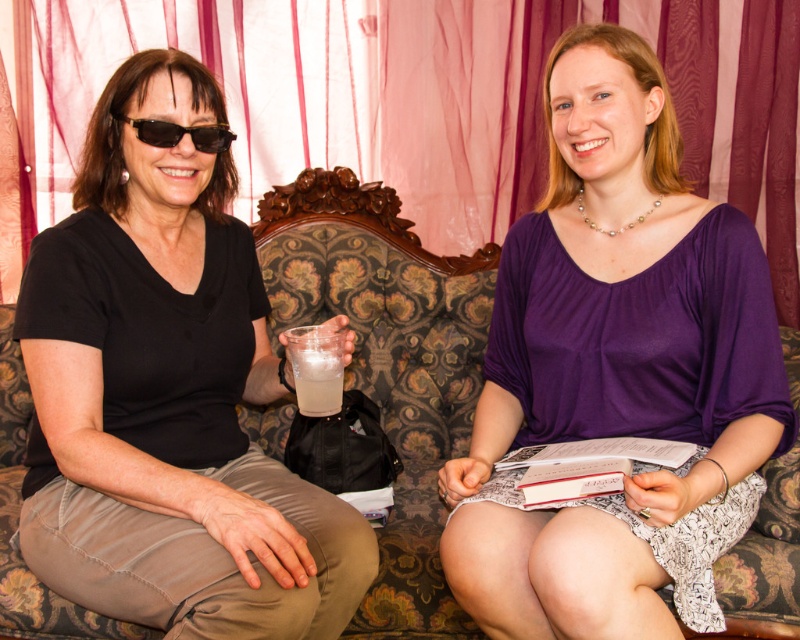
Is point (441, 417) positioned behind point (134, 124)?

Yes.

From the picture: Who is higher up, patterned fabric couch at center or black plastic sunglasses at left?

black plastic sunglasses at left is above.

What are the coordinates of `patterned fabric couch at center` in the screenshot? It's located at (389, 362).

Image resolution: width=800 pixels, height=640 pixels. In order to click on patterned fabric couch at center in this screenshot , I will do `click(389, 362)`.

Who is taller, pink sheer curtain at upper center or clear plastic cup at center?

pink sheer curtain at upper center

Can you confirm if pink sheer curtain at upper center is bigger than clear plastic cup at center?

Indeed, pink sheer curtain at upper center has a larger size compared to clear plastic cup at center.

The image size is (800, 640). In order to click on pink sheer curtain at upper center in this screenshot , I will do `click(416, 102)`.

Is black matte shirt at left positioned before pink sheer curtain at upper center?

Yes.

Locate an element on the screen. The height and width of the screenshot is (640, 800). black matte shirt at left is located at coordinates (168, 394).

Does point (110, 86) come behind point (672, 52)?

No, it is not.

You are a GUI agent. You are given a task and a screenshot of the screen. Output one action in this format:
    pyautogui.click(x=<x>, y=<y>)
    Task: Click on the black matte shirt at left
    
    Given the screenshot: What is the action you would take?
    pyautogui.click(x=168, y=394)